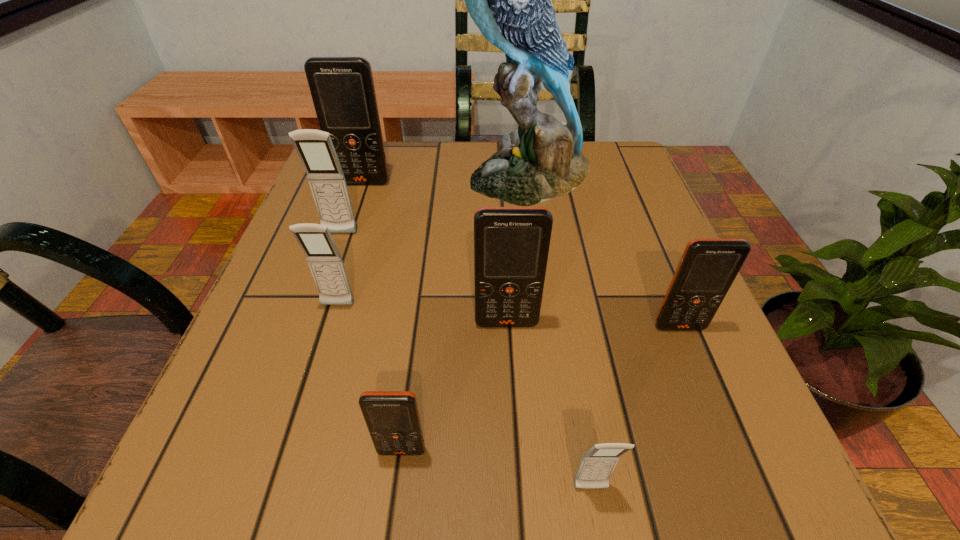
Locate an element on the screen. This screenshot has height=540, width=960. free spot located on the screen of the second biggest orange cellular telephone is located at coordinates (509, 361).

Identify the location of free region located on the front-facing side of the second farthest gray cellular telephone. (324, 351).

Locate an element on the screen. The image size is (960, 540). parakeet that is at the far edge is located at coordinates (509, 0).

Locate an element on the screen. cellular telephone situated at the far edge is located at coordinates (342, 88).

This screenshot has height=540, width=960. I want to click on parakeet present at the right edge, so click(x=509, y=0).

This screenshot has height=540, width=960. Identify the location of cellular telephone present at the right edge. (708, 267).

Where is `object present at the far left corner`? This screenshot has height=540, width=960. object present at the far left corner is located at coordinates (342, 88).

At what (x,y) coordinates should I click in order to perform the action: click on object present at the far right corner. Please return your answer as a coordinate pair (x, y). Looking at the image, I should click on (509, 0).

The height and width of the screenshot is (540, 960). In the image, there is a desktop. Find the location of `vacant space at the far edge`. vacant space at the far edge is located at coordinates (389, 187).

You are a GUI agent. You are given a task and a screenshot of the screen. Output one action in this format:
    pyautogui.click(x=<x>, y=<y>)
    Task: Click on the vacant space at the near edge of the desktop
    The width and height of the screenshot is (960, 540).
    Given the screenshot: What is the action you would take?
    pyautogui.click(x=566, y=464)